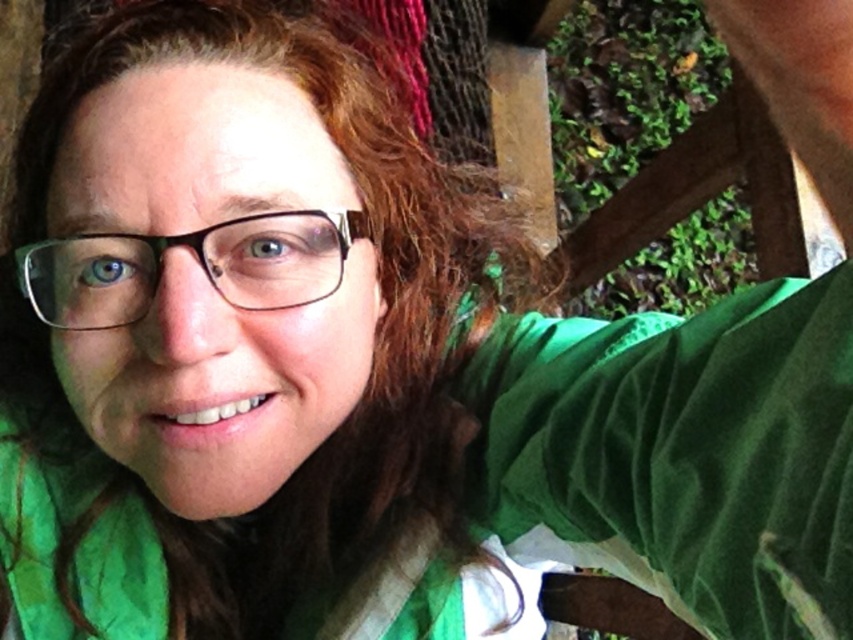
Question: Is brownhair at center to the left of clear plastic glasses at center from the viewer's perspective?

Choices:
 (A) yes
 (B) no

Answer: (B)

Question: Does velvet green shirt at upper right have a greater width compared to clear plastic glasses at center?

Choices:
 (A) yes
 (B) no

Answer: (B)

Question: Which point is closer to the camera?

Choices:
 (A) clear plastic glasses at center
 (B) brownhair at center

Answer: (B)

Question: Among these points, which one is farthest from the camera?

Choices:
 (A) (18, 266)
 (B) (732, 488)
 (C) (157, 170)

Answer: (A)

Question: Can you confirm if velvet green shirt at upper right is positioned below clear plastic glasses at center?

Choices:
 (A) no
 (B) yes

Answer: (B)

Question: Which point is closer to the camera?

Choices:
 (A) (665, 355)
 (B) (252, 234)

Answer: (A)